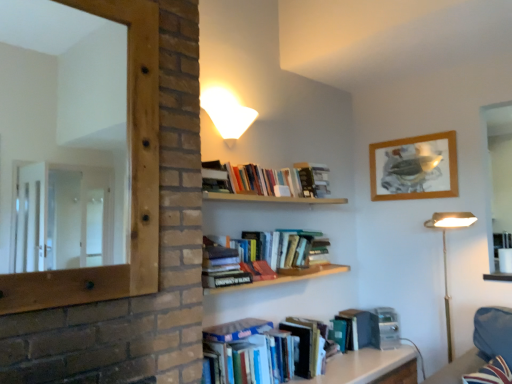
Question: From the image's perspective, is hardcover books at upper center, which ranks as the first book in top-to-bottom order, located above or below hardcover book at upper center, the second paperback book in the bottom-to-top sequence?

Choices:
 (A) below
 (B) above

Answer: (A)

Question: Would you say hardcover books at upper center, the 2th book when ordered from bottom to top, is to the left or to the right of hardcover book at upper center, the second paperback book in the bottom-to-top sequence, in the picture?

Choices:
 (A) right
 (B) left

Answer: (B)

Question: Estimate the real-world distances between objects in this image. Which object is farther from the gold metallic floor lamp at right?

Choices:
 (A) wooden framed picture at upper right
 (B) hardcover books at lower center, the 2th book positioned from the top
 (C) wooden table at lower center
 (D) hardcover book at upper center, the second paperback book in the bottom-to-top sequence
 (E) hardcover books at upper center, which ranks as the first book in top-to-bottom order

Answer: (B)

Question: Estimate the real-world distances between objects in this image. Which object is closer to the hardcover books at lower center, which is the 1th book in bottom-to-top order?

Choices:
 (A) white glossy wall lamp at upper center
 (B) hardcover books at upper center, which ranks as the first book in top-to-bottom order
 (C) wooden mirror at left
 (D) hardcover book at upper center, the second paperback book in the bottom-to-top sequence
 (E) gold metallic floor lamp at right

Answer: (B)